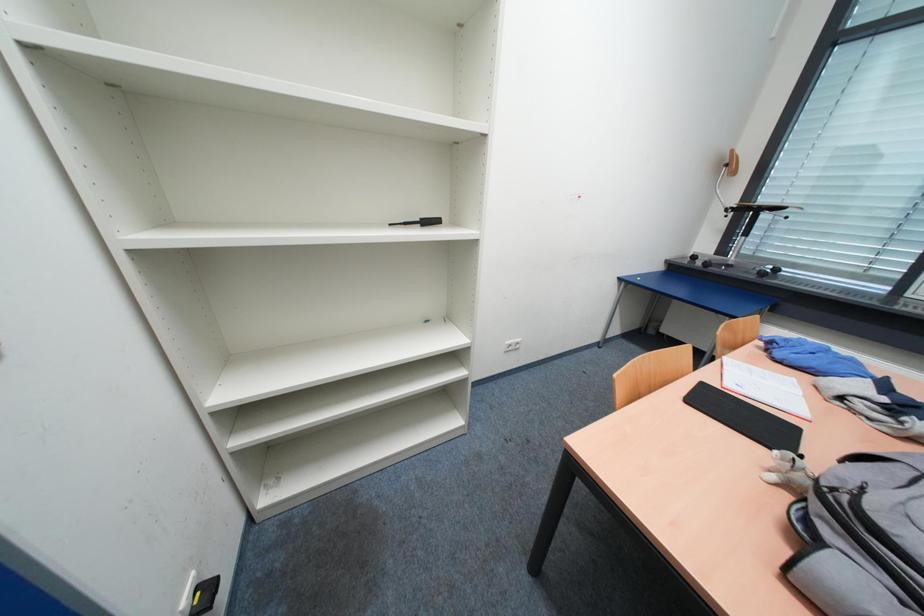
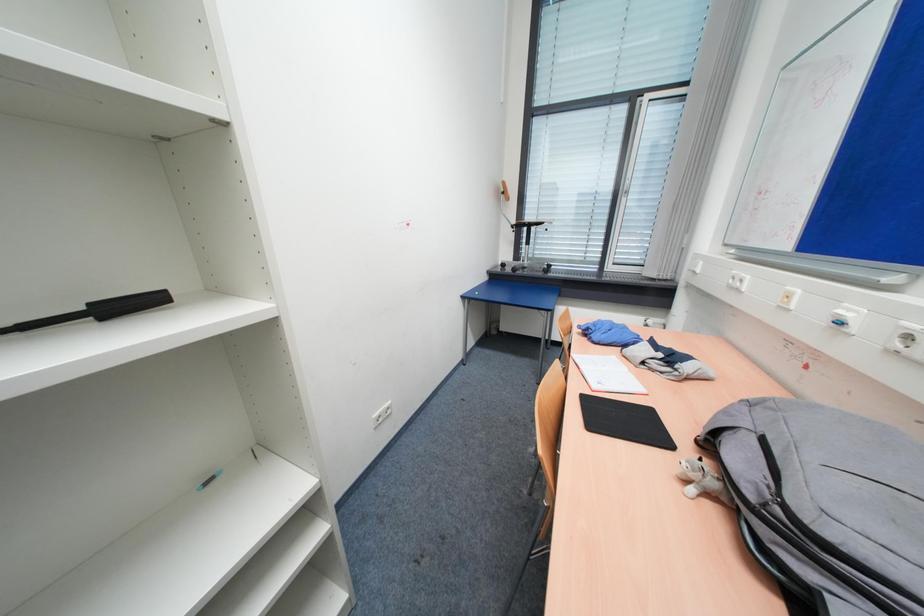
Question: The camera is either moving clockwise (left) or counter-clockwise (right) around the object. The first image is from the beginning of the video and the second image is from the end. Is the camera moving left or right when shooting the video?

Choices:
 (A) Left
 (B) Right

Answer: (A)